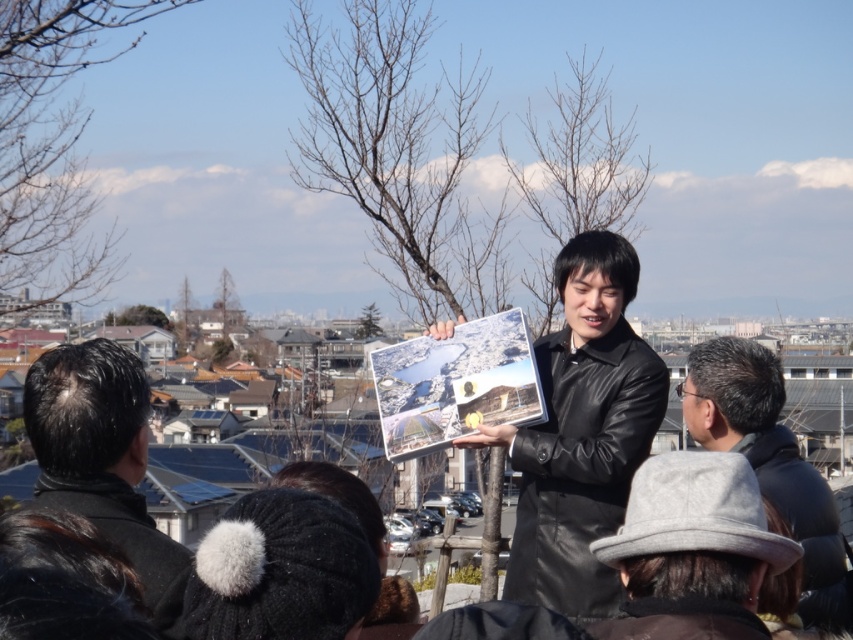
This screenshot has height=640, width=853. I want to click on black matte hair at lower left, so click(x=103, y=460).

Is point (26, 406) less distant than point (703, 438)?

Yes, it is in front of point (703, 438).

Which is behind, point (82, 444) or point (699, 348)?

The point (699, 348) is behind.

Where is `black matte hair at lower left`? This screenshot has height=640, width=853. black matte hair at lower left is located at coordinates (103, 460).

Is black leather jacket at center further to camera compared to gray woolen hat at lower right?

Yes.

Is black leather jacket at center to the left of gray woolen hat at lower right from the viewer's perspective?

Correct, you'll find black leather jacket at center to the left of gray woolen hat at lower right.

What are the coordinates of `black leather jacket at center` in the screenshot? It's located at [581, 433].

This screenshot has width=853, height=640. Identify the location of black leather jacket at center. (581, 433).

Is black leather jacket at center bigger than black matte hair at lower left?

Yes, black leather jacket at center is bigger than black matte hair at lower left.

I want to click on black leather jacket at center, so click(581, 433).

This screenshot has width=853, height=640. I want to click on black leather jacket at center, so click(x=581, y=433).